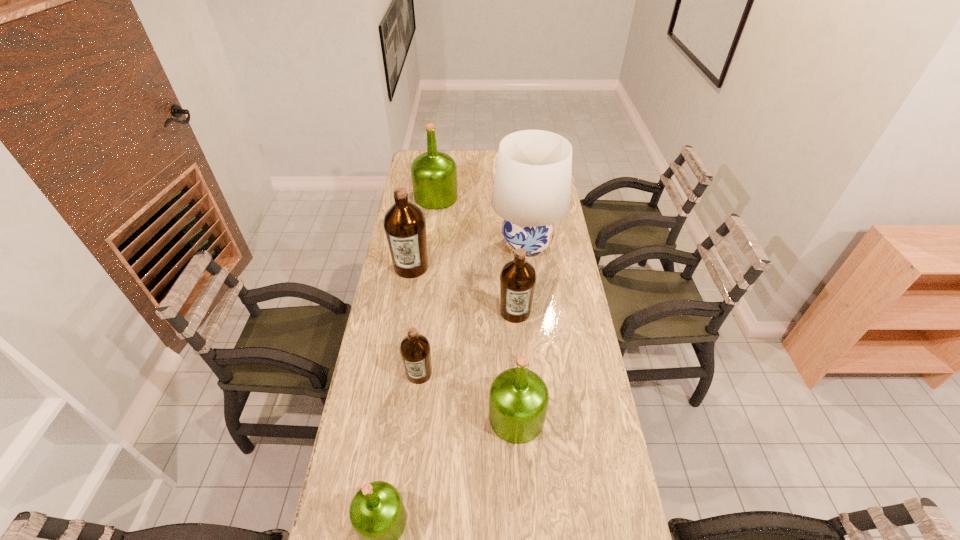
Identify the location of lampshade. (532, 185).

The height and width of the screenshot is (540, 960). Find the location of `blue lampshade`. blue lampshade is located at coordinates (532, 185).

At what (x,y) coordinates should I click in order to perform the action: click on the biggest brown olive oil. Please return your answer as a coordinate pair (x, y). The image size is (960, 540). Looking at the image, I should click on (404, 223).

Identify the location of the fifth nearest olive oil. (404, 223).

You are a GUI agent. You are given a task and a screenshot of the screen. Output one action in this format:
    pyautogui.click(x=<x>, y=<y>)
    Task: Click on the farthest object
    This screenshot has height=540, width=960.
    Given the screenshot: What is the action you would take?
    click(434, 174)

This screenshot has height=540, width=960. I want to click on the farthest olive oil, so click(434, 174).

Where is `the third farthest olive oil`? the third farthest olive oil is located at coordinates (518, 277).

The image size is (960, 540). Identify the location of the fourth nearest object. (518, 277).

Find the location of a particular element. The image size is (960, 540). the sixth farthest object is located at coordinates (518, 398).

The height and width of the screenshot is (540, 960). In order to click on the second smallest green olive oil in this screenshot , I will do `click(518, 398)`.